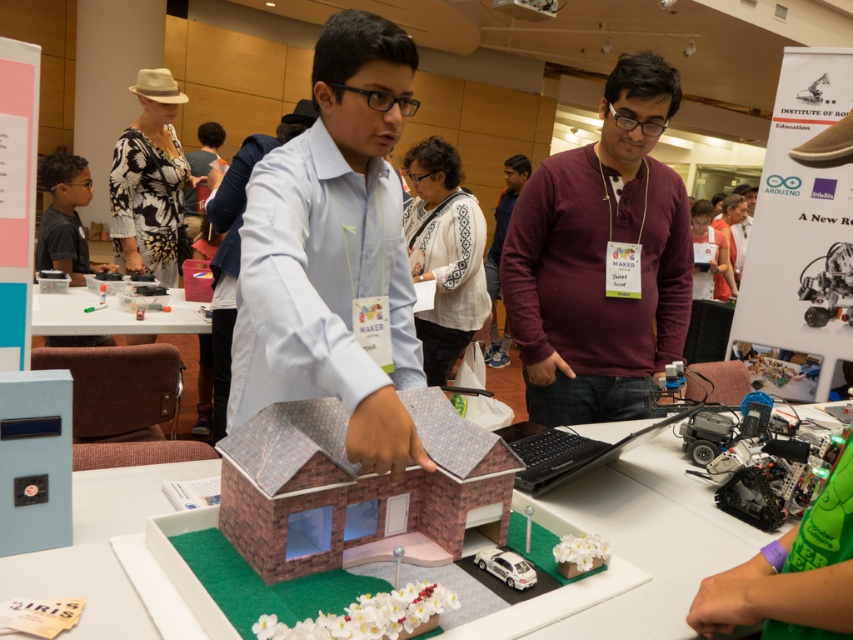
Question: Which object is the closest to the light blue shirt at center?

Choices:
 (A) white embroidered shirt at center
 (B) maroon sweater at center
 (C) green felt table at center
 (D) white plastic table at center

Answer: (C)

Question: From the image, what is the correct spatial relationship of maroon sweater at center in relation to white plastic table at center?

Choices:
 (A) below
 (B) above

Answer: (B)

Question: Estimate the real-world distances between objects in this image. Which object is closer to the white embroidered shirt at center?

Choices:
 (A) light blue shirt at center
 (B) green felt table at center

Answer: (B)

Question: Does light blue shirt at center come behind green felt table at center?

Choices:
 (A) no
 (B) yes

Answer: (A)

Question: Is light blue shirt at center above white embroidered shirt at center?

Choices:
 (A) no
 (B) yes

Answer: (A)

Question: Which object is farther from the camera taking this photo?

Choices:
 (A) green felt table at center
 (B) white embroidered shirt at center

Answer: (B)